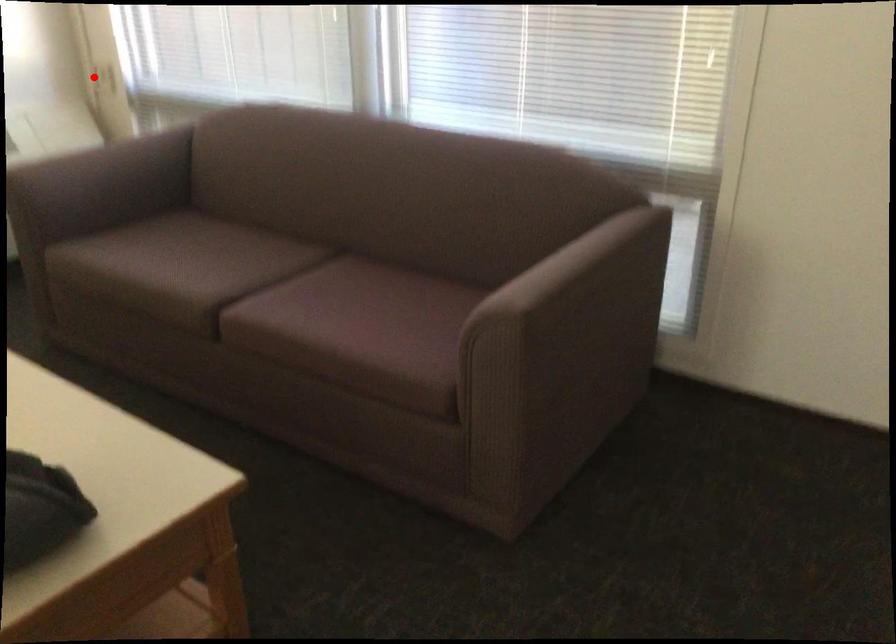
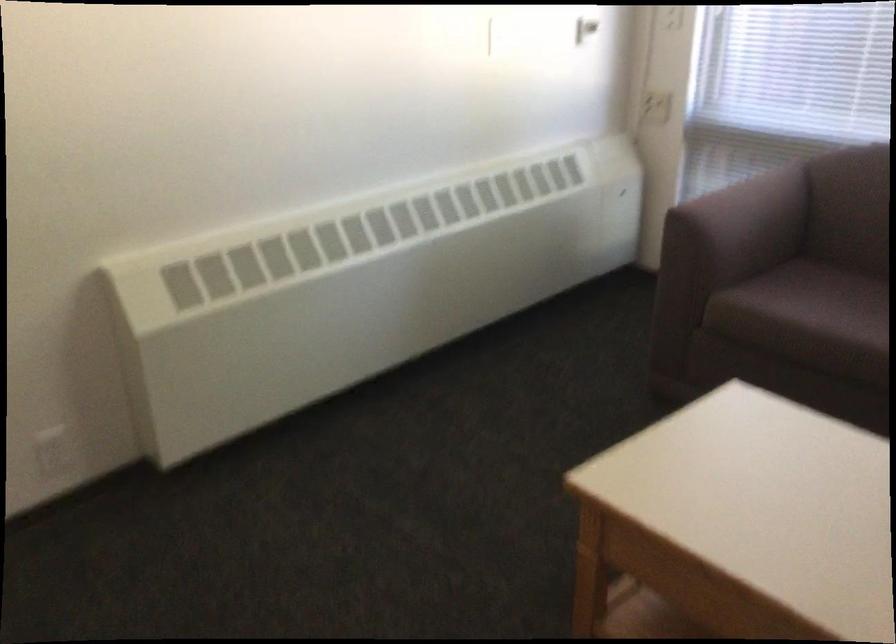
In the second image, find the point that corresponds to the highlighted location in the first image.

(656, 107)